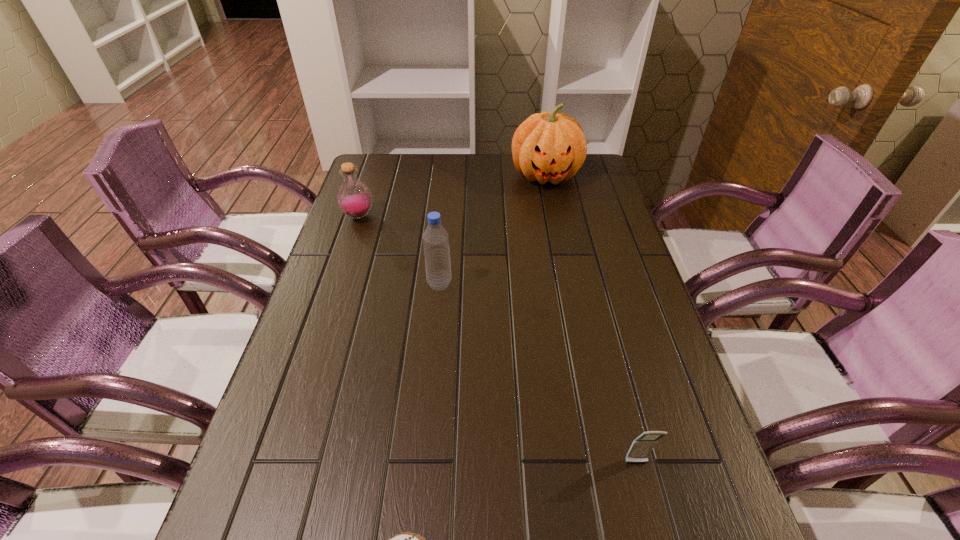
You are a GUI agent. You are given a task and a screenshot of the screen. Output one action in this format:
    pyautogui.click(x=<x>, y=<y>)
    Task: Click on the farthest object
    
    Given the screenshot: What is the action you would take?
    pyautogui.click(x=547, y=146)

What are the coordinates of `the nearer bottle` in the screenshot? It's located at click(x=435, y=238).

Locate an element on the screen. The height and width of the screenshot is (540, 960). the second tallest object is located at coordinates (435, 238).

Where is `the farther bottle`? the farther bottle is located at coordinates (354, 198).

This screenshot has height=540, width=960. Identify the location of the third tallest object. (354, 198).

You are a GUI agent. You are given a task and a screenshot of the screen. Output one action in this format:
    pyautogui.click(x=<x>, y=<y>)
    Task: Click on the cellular telephone
    Image resolution: width=960 pixels, height=540 pixels.
    Given the screenshot: What is the action you would take?
    pyautogui.click(x=641, y=447)

Image resolution: width=960 pixels, height=540 pixels. I want to click on the fourth tallest object, so click(x=641, y=447).

I want to click on vacant space located 0.070m on the carved face of the farthest object, so click(x=552, y=207).

Locate an element on the screen. This screenshot has width=960, height=540. vacant space located on the right of the right bottle is located at coordinates (528, 284).

This screenshot has width=960, height=540. Identify the location of vacant space situated 0.340m on the front of the leftmost object. (327, 310).